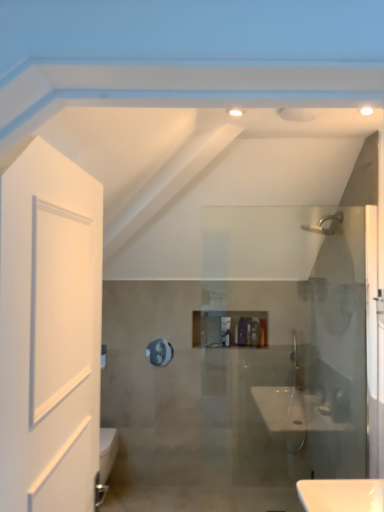
Question: Considering the relative sizes of matte silver faucet at upper right and matte purple bottle at center in the image provided, is matte silver faucet at upper right thinner than matte purple bottle at center?

Choices:
 (A) yes
 (B) no

Answer: (B)

Question: Is matte silver faucet at upper right surrounding matte purple bottle at center?

Choices:
 (A) no
 (B) yes

Answer: (A)

Question: From the image's perspective, does matte silver faucet at upper right appear lower than matte purple bottle at center?

Choices:
 (A) no
 (B) yes

Answer: (A)

Question: From a real-world perspective, is matte silver faucet at upper right located higher than matte purple bottle at center?

Choices:
 (A) yes
 (B) no

Answer: (A)

Question: Does matte silver faucet at upper right appear on the left side of matte purple bottle at center?

Choices:
 (A) yes
 (B) no

Answer: (B)

Question: In terms of height, does white matte door at left look taller or shorter compared to matte silver faucet at upper right?

Choices:
 (A) short
 (B) tall

Answer: (B)

Question: In the image, is white matte door at left positioned in front of or behind matte silver faucet at upper right?

Choices:
 (A) behind
 (B) front

Answer: (B)

Question: Based on their positions, is white matte door at left located to the left or right of matte silver faucet at upper right?

Choices:
 (A) right
 (B) left

Answer: (B)

Question: Which is correct: white matte door at left is inside matte silver faucet at upper right, or outside of it?

Choices:
 (A) inside
 (B) outside

Answer: (B)

Question: From the image's perspective, is white matte door at left above or below matte purple bottle at center?

Choices:
 (A) below
 (B) above

Answer: (B)

Question: In the image, is white matte door at left positioned in front of or behind matte purple bottle at center?

Choices:
 (A) front
 (B) behind

Answer: (A)

Question: Looking at the image, does white matte door at left seem bigger or smaller compared to matte purple bottle at center?

Choices:
 (A) small
 (B) big

Answer: (B)

Question: Considering the positions of white matte door at left and matte purple bottle at center in the image, is white matte door at left taller or shorter than matte purple bottle at center?

Choices:
 (A) tall
 (B) short

Answer: (A)

Question: From the image's perspective, is matte silver faucet at upper right positioned above or below metallic reflective mirror at center?

Choices:
 (A) above
 (B) below

Answer: (A)

Question: Is point (342, 214) positioned closer to the camera than point (153, 353)?

Choices:
 (A) closer
 (B) farther

Answer: (A)